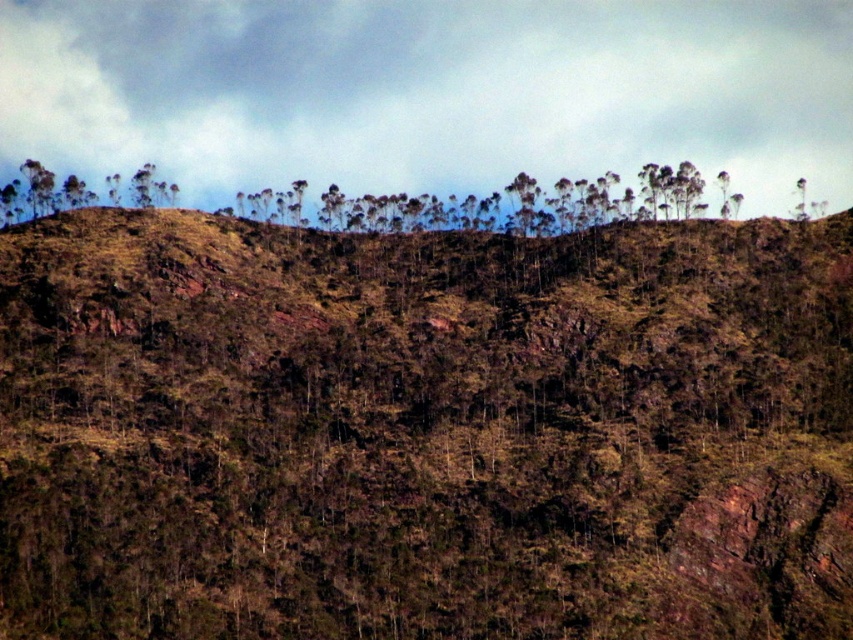
Question: Which of the following is the closest to the observer?

Choices:
 (A) brown rough hillside at upper center
 (B) cloudy sky at upper center

Answer: (A)

Question: Which point appears closest to the camera in this image?

Choices:
 (A) (440, 602)
 (B) (526, 49)

Answer: (A)

Question: Can you confirm if brown rough hillside at upper center is wider than cloudy sky at upper center?

Choices:
 (A) yes
 (B) no

Answer: (B)

Question: Can you confirm if brown rough hillside at upper center is smaller than cloudy sky at upper center?

Choices:
 (A) no
 (B) yes

Answer: (A)

Question: From the image, what is the correct spatial relationship of brown rough hillside at upper center in relation to cloudy sky at upper center?

Choices:
 (A) left
 (B) right

Answer: (B)